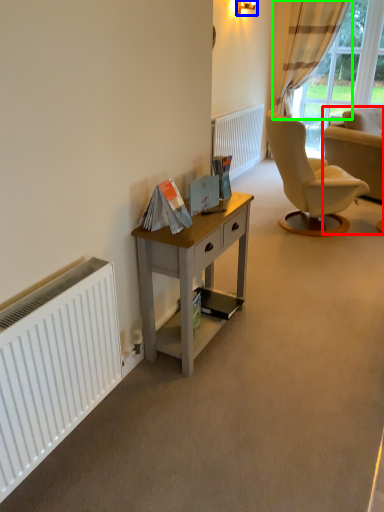
Question: Considering the real-world distances, which object is closest to chair (highlighted by a red box)? lamp (highlighted by a blue box) or curtain (highlighted by a green box).

Choices:
 (A) lamp
 (B) curtain

Answer: (A)